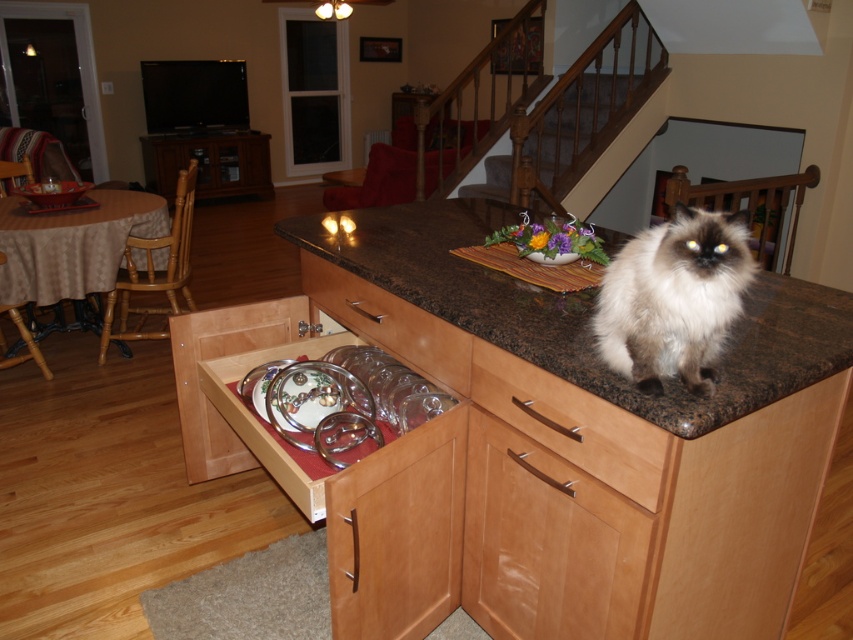
Who is shorter, wooden drawer at center or clear glass plates at center?

wooden drawer at center is shorter.

The image size is (853, 640). What do you see at coordinates (572, 422) in the screenshot?
I see `wooden drawer at center` at bounding box center [572, 422].

Image resolution: width=853 pixels, height=640 pixels. I want to click on wooden drawer at center, so click(x=572, y=422).

Is granite countertop at center above wooden drawer at center?

Indeed, granite countertop at center is positioned over wooden drawer at center.

What do you see at coordinates (585, 314) in the screenshot? The height and width of the screenshot is (640, 853). I see `granite countertop at center` at bounding box center [585, 314].

Where is `granite countertop at center`? granite countertop at center is located at coordinates (585, 314).

Between granite countertop at center and clear glass plates at center, which one appears on the left side from the viewer's perspective?

clear glass plates at center is more to the left.

Consider the image. Between granite countertop at center and clear glass plates at center, which one has less height?

Standing shorter between the two is clear glass plates at center.

Between point (326, 241) and point (392, 328), which one is positioned behind?

The point (326, 241) is more distant.

You are a GUI agent. You are given a task and a screenshot of the screen. Output one action in this format:
    pyautogui.click(x=<x>, y=<y>)
    Task: Click on the granite countertop at center
    
    Given the screenshot: What is the action you would take?
    pyautogui.click(x=585, y=314)